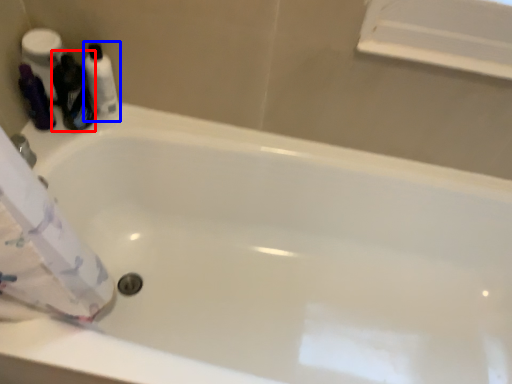
Question: Which object is closer to the camera taking this photo, cleaning product (highlighted by a red box) or toiletry (highlighted by a blue box)?

Choices:
 (A) cleaning product
 (B) toiletry

Answer: (A)